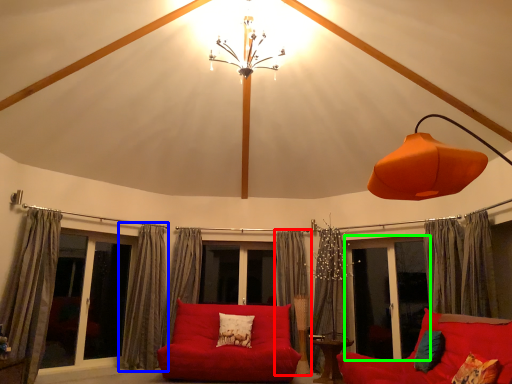
Question: Based on their relative distances, which object is farther from curtain (highlighted by a red box)? Choose from curtain (highlighted by a blue box) and window screen (highlighted by a green box).

Choices:
 (A) curtain
 (B) window screen

Answer: (A)